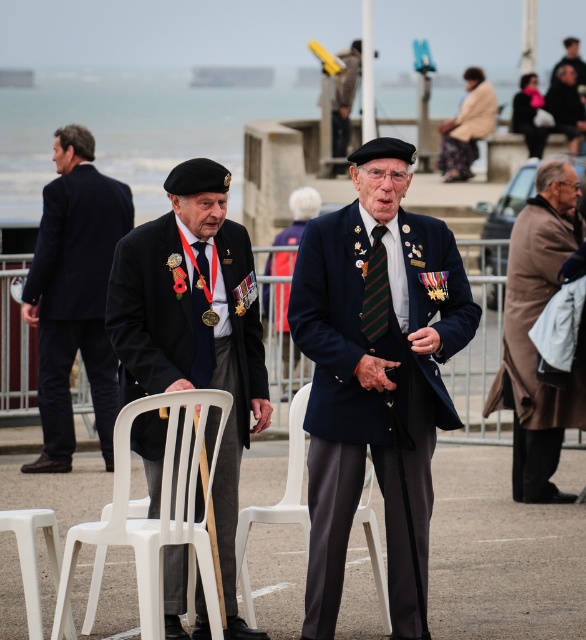
You are standing at point (182, 410) and want to walk to point (134, 243). Which direction should you move in to reach your destination?

To reach point (134, 243) from point (182, 410), you should move north because point (134, 243) is behind point (182, 410).

You are a photographer at the event and need to frame a shot that includes both the matte black suit at center and the white plastic folding chair at lower left. Which object should you position closer to the foreground to ensure both are in focus?

The matte black suit at center is taller than the white plastic folding chair at lower left, so positioning the matte black suit at center closer to the foreground will help keep both in focus by aligning their planes within the depth of field.

You are attending a formal event at the waterfront and notice a point marked at coordinates (148, 310). What object is located at this point?

The point at coordinates (148, 310) corresponds to the matte black suit at center.